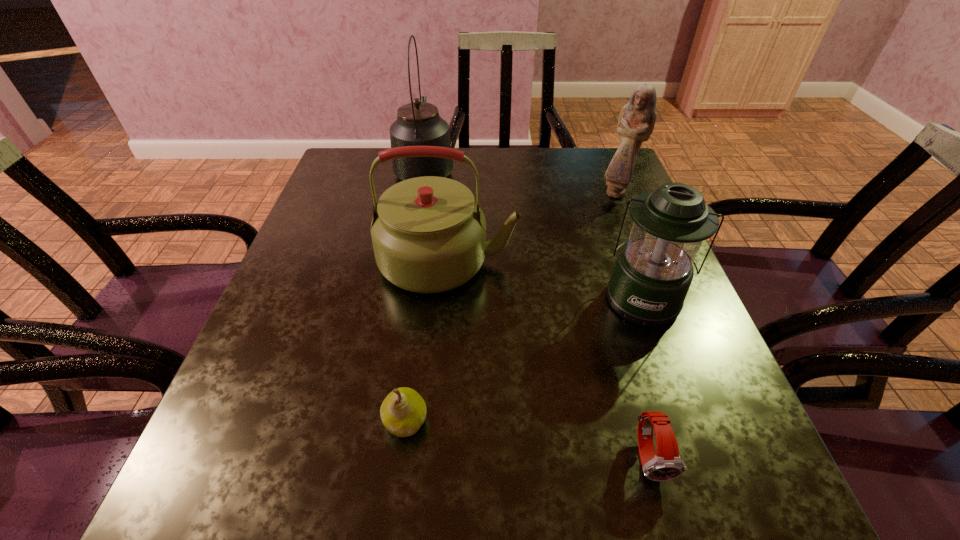
Image resolution: width=960 pixels, height=540 pixels. In the image, there is a desktop. Find the location of `vacant area at the far edge`. vacant area at the far edge is located at coordinates tap(564, 192).

What are the coordinates of `free space at the near edge` in the screenshot? It's located at (304, 528).

Locate an element on the screen. The width and height of the screenshot is (960, 540). vacant space at the left edge of the desktop is located at coordinates (263, 363).

In the image, there is a desktop. Identify the location of vacant area at the right edge. Image resolution: width=960 pixels, height=540 pixels. (694, 342).

You are a GUI agent. You are given a task and a screenshot of the screen. Output one action in this format:
    pyautogui.click(x=<x>, y=<y>)
    Task: Click on the free space at the far right corner
    
    Given the screenshot: What is the action you would take?
    pyautogui.click(x=608, y=186)

Where is `vacant area between the lantern and the tallest object`? Image resolution: width=960 pixels, height=540 pixels. vacant area between the lantern and the tallest object is located at coordinates (534, 233).

In order to click on free spot between the lantern and the nearer kettle in this screenshot , I will do pos(545,280).

You are a GUI agent. You are given a task and a screenshot of the screen. Output one action in this format:
    pyautogui.click(x=<x>, y=<y>)
    Task: Click on the free area in between the shorter kettle and the figurine
    The width and height of the screenshot is (960, 540).
    Given the screenshot: What is the action you would take?
    pyautogui.click(x=533, y=227)

You are a GUI agent. You are given a task and a screenshot of the screen. Output one action in this format:
    pyautogui.click(x=<x>, y=<y>)
    Task: Click on the vacant space that's between the lantern and the pear
    
    Given the screenshot: What is the action you would take?
    pyautogui.click(x=524, y=360)

Identify the location of free spot between the fifth tallest object and the shortest object. Image resolution: width=960 pixels, height=540 pixels. (527, 439).